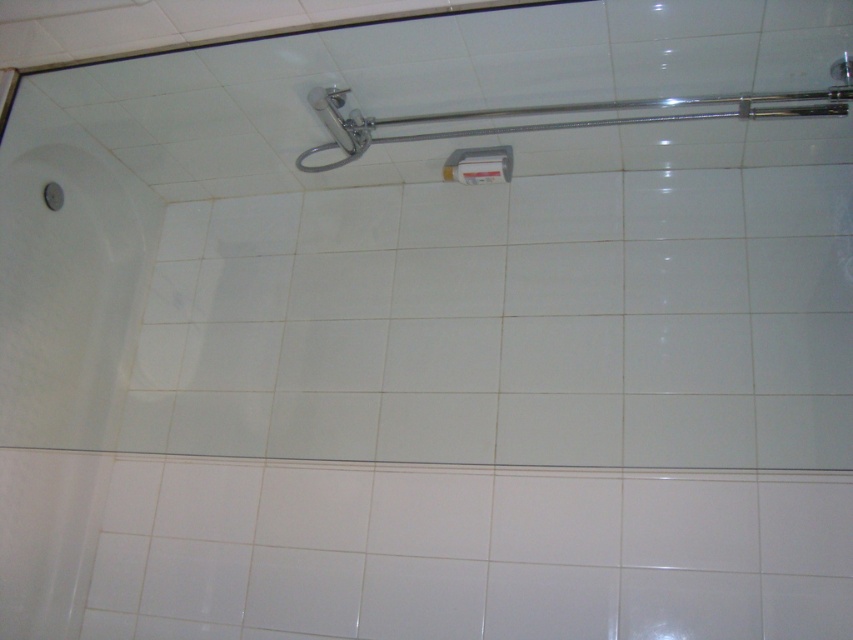
Does chrome/metallic shower arm at upper center have a lesser height compared to white plastic towel bar at upper center?

No, chrome/metallic shower arm at upper center is not shorter than white plastic towel bar at upper center.

From the picture: Can you confirm if chrome/metallic shower arm at upper center is positioned below white plastic towel bar at upper center?

Actually, chrome/metallic shower arm at upper center is above white plastic towel bar at upper center.

Where is `chrome/metallic shower arm at upper center`? chrome/metallic shower arm at upper center is located at coordinates (560, 116).